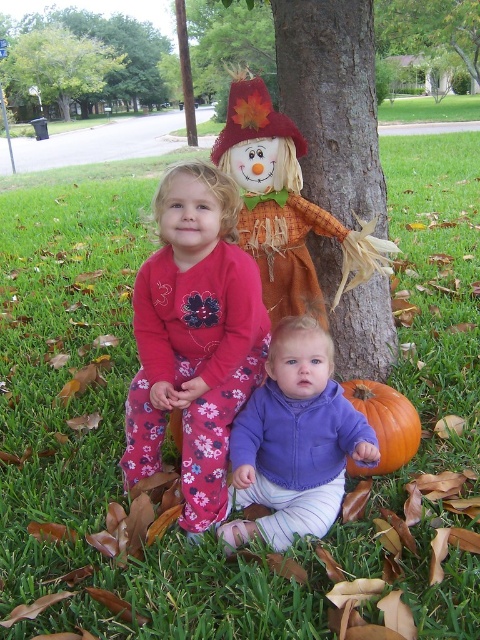
You are a photographer standing at the center of the image. You want to take a photo of the matte orange scarecrow at center. Where should you aim your camera to capture it perfectly?

You should aim your camera at the coordinates point (285, 205) to capture the matte orange scarecrow at center perfectly.

You are a photographer setting up a shot of the matte orange scarecrow at center and the orange matte pumpkin at lower center. You want to ensure both subjects are fully visible in the frame. Which subject requires a wider angle to capture its full width?

The matte orange scarecrow at center requires a wider angle to capture its full width because its width is larger than the orange matte pumpkin at lower center.

You are a photographer trying to capture a photo of both the green leafy tree at upper center and the orange matte pumpkin at lower center. Based on their positions, which object should you focus on first to ensure both are in the frame?

The green leafy tree at upper center is located above the orange matte pumpkin at lower center, so you should focus on the green leafy tree at upper center first to ensure both are in the frame.